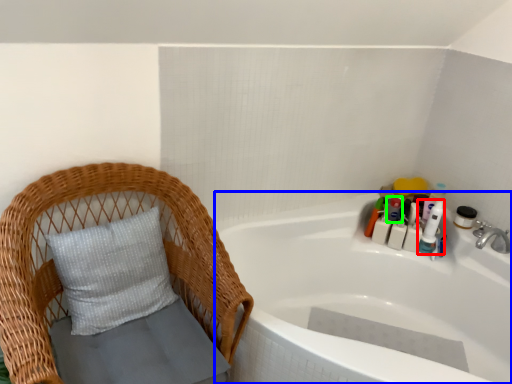
Question: Estimate the real-world distances between objects in this image. Which object is closer to toiletry (highlighted by a red box), bathtub (highlighted by a blue box) or toiletry (highlighted by a green box)?

Choices:
 (A) bathtub
 (B) toiletry

Answer: (B)